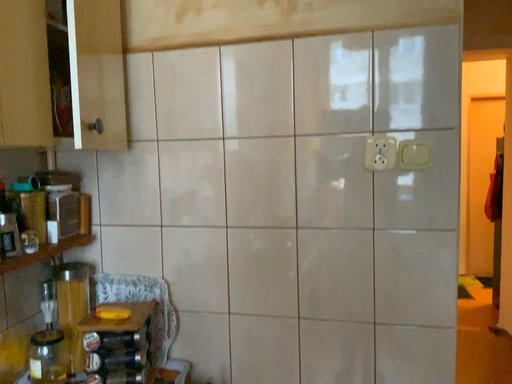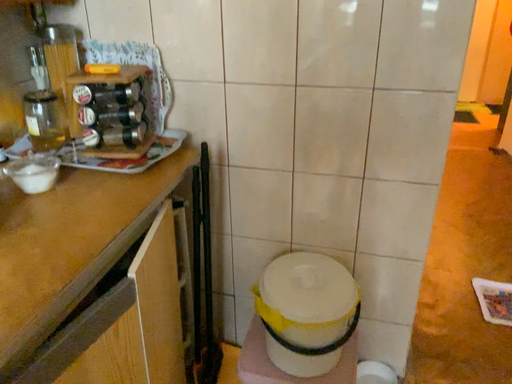
Question: How did the camera likely rotate when shooting the video?

Choices:
 (A) rotated upward
 (B) rotated downward

Answer: (B)